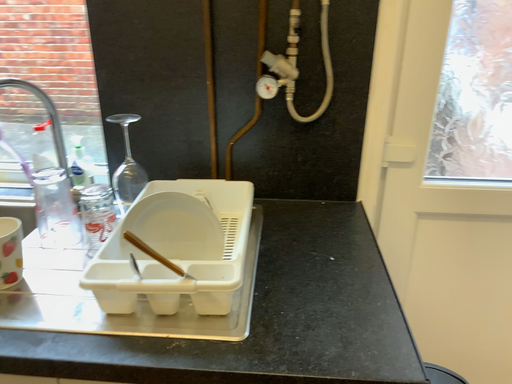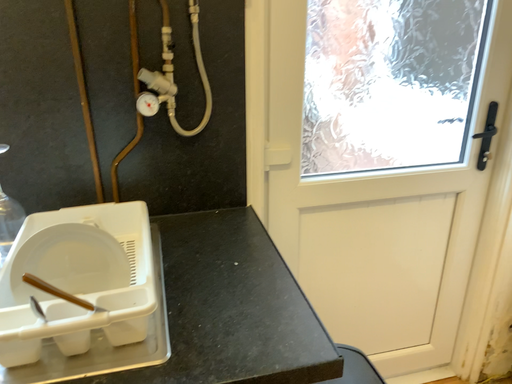
Question: How did the camera likely rotate when shooting the video?

Choices:
 (A) rotated right
 (B) rotated left

Answer: (A)